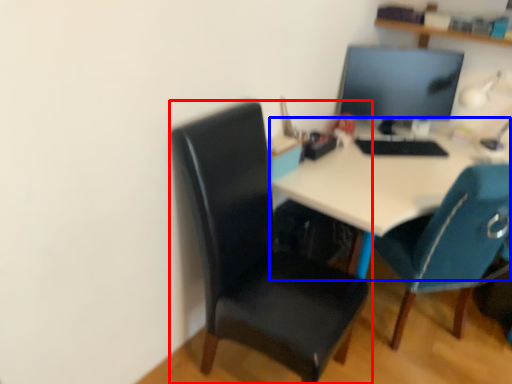
Question: Which point is further to the camera, chair (highlighted by a red box) or desk (highlighted by a blue box)?

Choices:
 (A) chair
 (B) desk

Answer: (B)